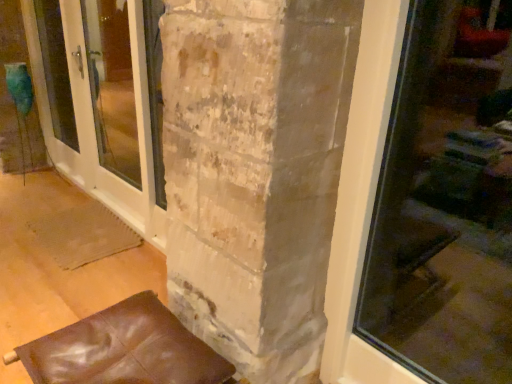
Question: Is white glossy screen door at left shorter than leather cushion at lower left?

Choices:
 (A) yes
 (B) no

Answer: (B)

Question: Is white glossy screen door at left to the left of leather cushion at lower left from the viewer's perspective?

Choices:
 (A) no
 (B) yes

Answer: (B)

Question: Can you confirm if white glossy screen door at left is positioned to the right of leather cushion at lower left?

Choices:
 (A) no
 (B) yes

Answer: (A)

Question: Can you confirm if white glossy screen door at left is taller than leather cushion at lower left?

Choices:
 (A) yes
 (B) no

Answer: (A)

Question: Is white glossy screen door at left turned away from leather cushion at lower left?

Choices:
 (A) no
 (B) yes

Answer: (A)

Question: Is leather cushion at lower left completely or partially inside white glossy screen door at left?

Choices:
 (A) yes
 (B) no

Answer: (B)

Question: Is leather cushion at lower left wider than white glossy screen door at left?

Choices:
 (A) yes
 (B) no

Answer: (A)

Question: Is the position of leather cushion at lower left more distant than that of white glossy screen door at left?

Choices:
 (A) yes
 (B) no

Answer: (B)

Question: From a real-world perspective, is leather cushion at lower left under white glossy screen door at left?

Choices:
 (A) yes
 (B) no

Answer: (A)

Question: Can you confirm if leather cushion at lower left is thinner than white glossy screen door at left?

Choices:
 (A) no
 (B) yes

Answer: (A)

Question: Can you confirm if leather cushion at lower left is bigger than white glossy screen door at left?

Choices:
 (A) no
 (B) yes

Answer: (A)

Question: From the image's perspective, is leather cushion at lower left below white glossy screen door at left?

Choices:
 (A) no
 (B) yes

Answer: (B)

Question: Do you think white glossy screen door at left is within leather cushion at lower left, or outside of it?

Choices:
 (A) outside
 (B) inside

Answer: (A)